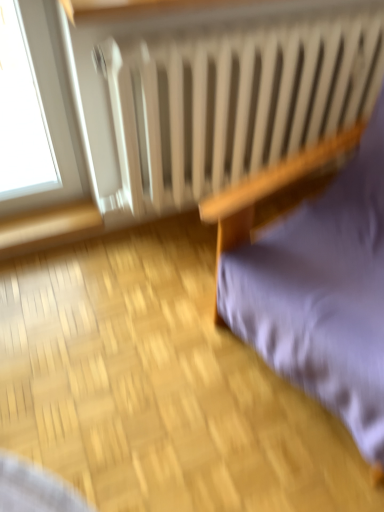
Question: Is purple fabric cushion at right taller than white matte radiator at upper center?

Choices:
 (A) yes
 (B) no

Answer: (B)

Question: Can you confirm if purple fabric cushion at right is positioned to the right of white matte radiator at upper center?

Choices:
 (A) no
 (B) yes

Answer: (B)

Question: Considering the relative positions of purple fabric cushion at right and white matte radiator at upper center in the image provided, is purple fabric cushion at right to the left of white matte radiator at upper center from the viewer's perspective?

Choices:
 (A) no
 (B) yes

Answer: (A)

Question: Is purple fabric cushion at right positioned beyond the bounds of white matte radiator at upper center?

Choices:
 (A) yes
 (B) no

Answer: (A)

Question: Would you say white matte radiator at upper center is part of purple fabric cushion at right's contents?

Choices:
 (A) no
 (B) yes

Answer: (A)

Question: Is the depth of purple fabric cushion at right less than that of white matte radiator at upper center?

Choices:
 (A) yes
 (B) no

Answer: (A)

Question: Does white matte radiator at upper center have a lesser height compared to purple fabric cushion at right?

Choices:
 (A) yes
 (B) no

Answer: (B)

Question: Is white matte radiator at upper center smaller than purple fabric cushion at right?

Choices:
 (A) yes
 (B) no

Answer: (A)

Question: From a real-world perspective, is white matte radiator at upper center beneath purple fabric cushion at right?

Choices:
 (A) no
 (B) yes

Answer: (B)

Question: Is white matte radiator at upper center not close to purple fabric cushion at right?

Choices:
 (A) yes
 (B) no

Answer: (B)

Question: From the image's perspective, is white matte radiator at upper center on purple fabric cushion at right?

Choices:
 (A) no
 (B) yes

Answer: (B)

Question: Is white matte radiator at upper center oriented away from purple fabric cushion at right?

Choices:
 (A) no
 (B) yes

Answer: (B)

Question: Looking at the image, does white matte radiator at upper center seem bigger or smaller compared to purple fabric cushion at right?

Choices:
 (A) small
 (B) big

Answer: (A)